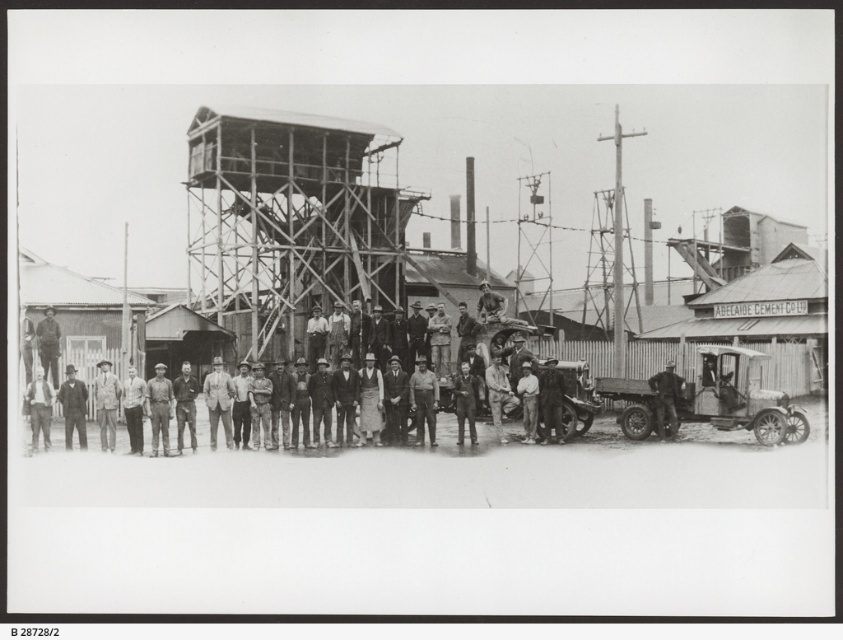
Which is more to the right, metallic scaffolding at center or light brown leather jacket at center?

metallic scaffolding at center is more to the right.

Does point (186, 246) come farther from viewer compared to point (103, 444)?

That is True.

Describe the element at coordinates (288, 221) in the screenshot. This screenshot has height=640, width=843. I see `metallic scaffolding at center` at that location.

Identify the location of metallic scaffolding at center. The height and width of the screenshot is (640, 843). (288, 221).

Between metallic scaffolding at center and dark gray uniform at center, which one is positioned lower?

dark gray uniform at center

Is point (196, 292) positioned before point (165, 394)?

That is False.

Where is `metallic scaffolding at center`? The width and height of the screenshot is (843, 640). metallic scaffolding at center is located at coordinates (288, 221).

Does light brown leather jacket at center come in front of dark gray uniform at center?

No.

Identify the location of light brown leather jacket at center. (106, 403).

The height and width of the screenshot is (640, 843). What do you see at coordinates (106, 403) in the screenshot?
I see `light brown leather jacket at center` at bounding box center [106, 403].

Find the location of a particular element. light brown leather jacket at center is located at coordinates (106, 403).